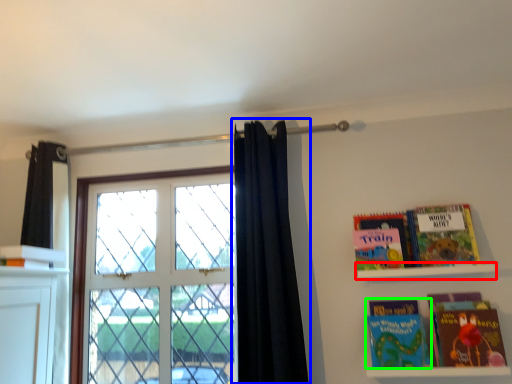
Question: Based on their relative distances, which object is farther from shelf (highlighted by a red box)? Choose from curtain (highlighted by a blue box) and book (highlighted by a green box).

Choices:
 (A) curtain
 (B) book

Answer: (A)